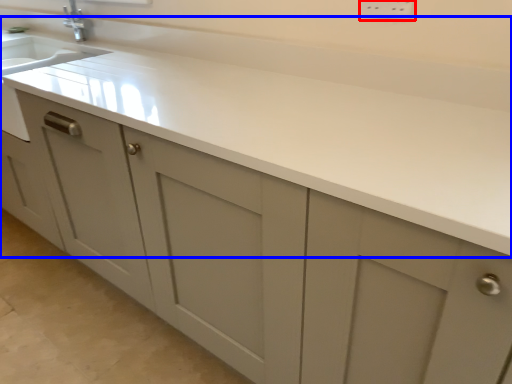
Question: Which point is closer to the camera, electric outlet (highlighted by a red box) or countertop (highlighted by a blue box)?

Choices:
 (A) electric outlet
 (B) countertop

Answer: (B)